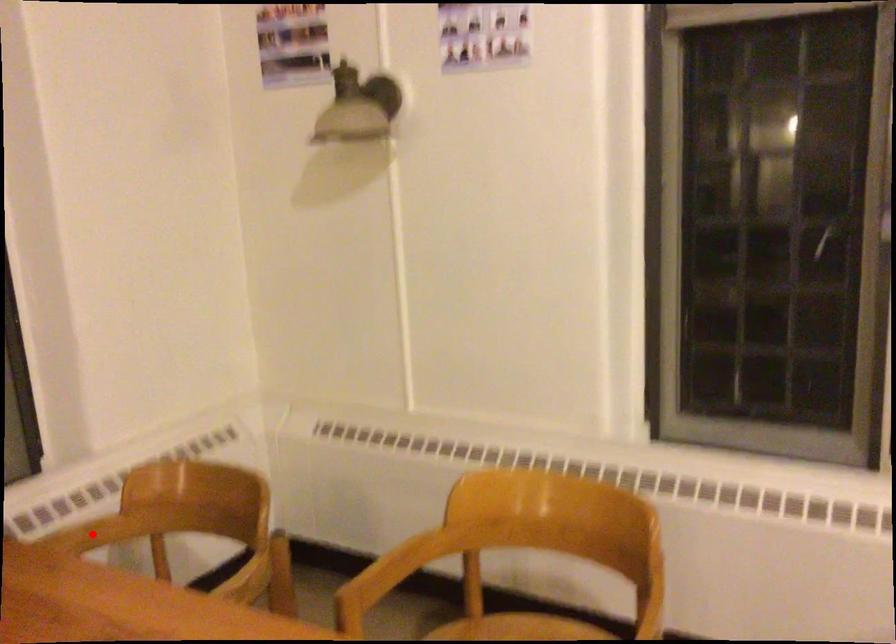
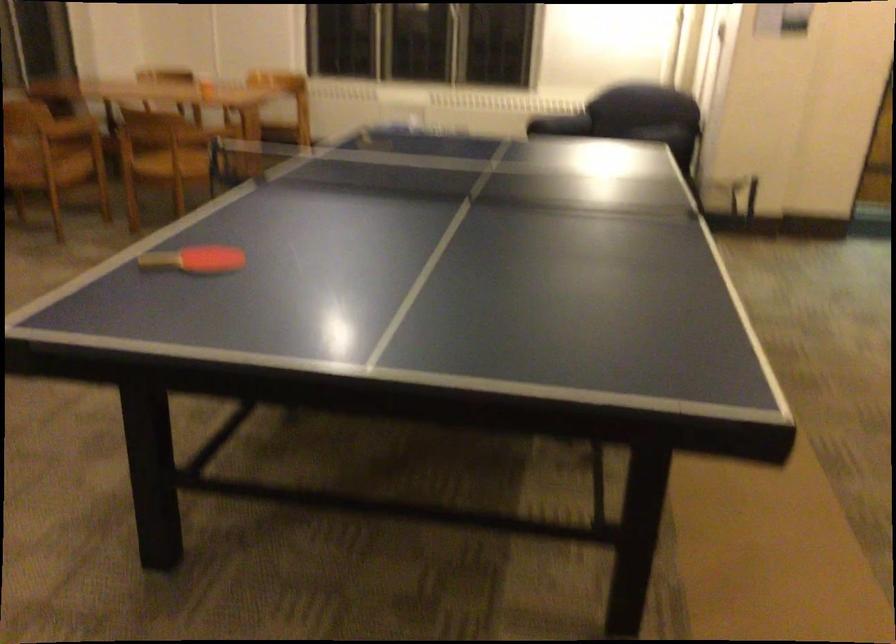
Question: I am providing you with two images of the same scene from different viewpoints. A red point is marked on the first image. Is the red point's position out of view in image 2?

Choices:
 (A) Yes
 (B) No

Answer: (A)